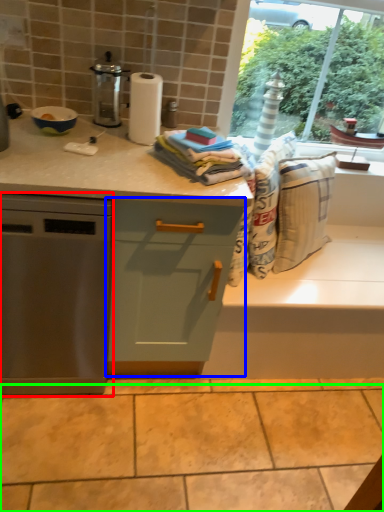
Question: Based on their relative distances, which object is nearer to home appliance (highlighted by a red box)? Choose from cabinetry (highlighted by a blue box) and granite (highlighted by a green box).

Choices:
 (A) cabinetry
 (B) granite

Answer: (A)